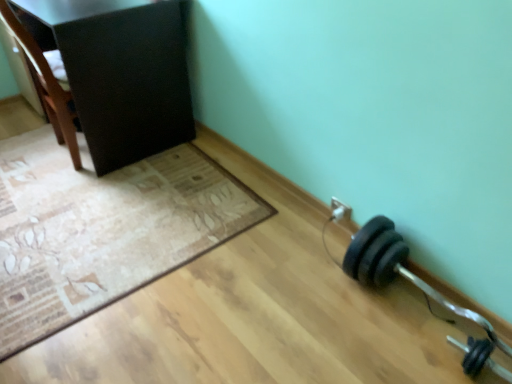
What do you see at coordinates (123, 74) in the screenshot? I see `matte black cabinet at upper left` at bounding box center [123, 74].

The height and width of the screenshot is (384, 512). What do you see at coordinates (408, 280) in the screenshot?
I see `black rubber dumbbell at lower right, which is the 1th dumbbell from top to bottom` at bounding box center [408, 280].

I want to click on black rubber dumbbell at lower right, placed as the 1th dumbbell when sorted from bottom to top, so click(x=499, y=370).

Where is `matte black cabinet at upper left`? This screenshot has height=384, width=512. matte black cabinet at upper left is located at coordinates (123, 74).

Find the location of a particular element. The width and height of the screenshot is (512, 384). dumbbell that is the 1st one below the brown wood chair at upper left (from a real-world perspective) is located at coordinates (408, 280).

Would you say brown wood chair at upper left is to the left or to the right of black rubber dumbbell at lower right, which is the 1th dumbbell from top to bottom, in the picture?

In the image, brown wood chair at upper left appears on the left side of black rubber dumbbell at lower right, which is the 1th dumbbell from top to bottom.

Considering the sizes of objects brown wood chair at upper left and black rubber dumbbell at lower right, the second dumbbell when ordered from bottom to top, in the image provided, who is smaller, brown wood chair at upper left or black rubber dumbbell at lower right, the second dumbbell when ordered from bottom to top,?

Smaller between the two is black rubber dumbbell at lower right, the second dumbbell when ordered from bottom to top.

Considering their positions, is brown wood chair at upper left located in front of or behind black rubber dumbbell at lower right, which is the 1th dumbbell from top to bottom?

Visually, brown wood chair at upper left is located behind black rubber dumbbell at lower right, which is the 1th dumbbell from top to bottom.

From a real-world perspective, is brown wood chair at upper left positioned under beige textured mat at lower left based on gravity?

No, from a real-world perspective, brown wood chair at upper left is not beneath beige textured mat at lower left.

Is brown wood chair at upper left closer to camera compared to beige textured mat at lower left?

No, brown wood chair at upper left is further to the viewer.

Is brown wood chair at upper left wider than beige textured mat at lower left?

Incorrect, the width of brown wood chair at upper left does not surpass that of beige textured mat at lower left.

Which is closer, (11,25) or (65,298)?

Point (11,25) appears to be farther away from the viewer than point (65,298).

Based on their sizes in the image, would you say beige textured mat at lower left is bigger or smaller than matte black cabinet at upper left?

Considering their sizes, beige textured mat at lower left takes up less space than matte black cabinet at upper left.

Which is more to the left, beige textured mat at lower left or matte black cabinet at upper left?

matte black cabinet at upper left.

From the image's perspective, relative to matte black cabinet at upper left, is beige textured mat at lower left above or below?

beige textured mat at lower left is situated lower than matte black cabinet at upper left in the image.

Considering the positions of point (221, 204) and point (163, 53), is point (221, 204) closer or farther from the camera than point (163, 53)?

Clearly, point (221, 204) is closer to the camera than point (163, 53).

Which is more to the right, black rubber dumbbell at lower right, the second dumbbell when ordered from bottom to top, or matte black cabinet at upper left?

From the viewer's perspective, black rubber dumbbell at lower right, the second dumbbell when ordered from bottom to top, appears more on the right side.

Is black rubber dumbbell at lower right, the second dumbbell when ordered from bottom to top, looking in the opposite direction of matte black cabinet at upper left?

No.

Would you consider black rubber dumbbell at lower right, which is the 1th dumbbell from top to bottom, to be distant from matte black cabinet at upper left?

That's right, there is a large distance between black rubber dumbbell at lower right, which is the 1th dumbbell from top to bottom, and matte black cabinet at upper left.

From a real-world perspective, is black rubber dumbbell at lower right, which is the 1th dumbbell from top to bottom, located higher than matte black cabinet at upper left?

Incorrect, from a real-world perspective, black rubber dumbbell at lower right, which is the 1th dumbbell from top to bottom, is lower than matte black cabinet at upper left.

Based on the photo, is beige textured mat at lower left looking in the opposite direction of brown wood chair at upper left?

No, brown wood chair at upper left is not at the back of beige textured mat at lower left.

Which of these two, beige textured mat at lower left or brown wood chair at upper left, stands shorter?

beige textured mat at lower left.

From the picture: Looking at the image, does matte black cabinet at upper left seem bigger or smaller compared to black rubber dumbbell at lower right, placed as the 1th dumbbell when sorted from bottom to top?

In the image, matte black cabinet at upper left appears to be larger than black rubber dumbbell at lower right, placed as the 1th dumbbell when sorted from bottom to top.

From the image's perspective, between matte black cabinet at upper left and black rubber dumbbell at lower right, the second dumbbell viewed from the top, which one is located above?

matte black cabinet at upper left.

The height and width of the screenshot is (384, 512). I want to click on the 2nd dumbbell to the right when counting from the matte black cabinet at upper left, so click(499, 370).

From a real-world perspective, between matte black cabinet at upper left and black rubber dumbbell at lower right, the second dumbbell viewed from the top, who is vertically higher?

matte black cabinet at upper left.

From a real-world perspective, is black rubber dumbbell at lower right, the second dumbbell when ordered from bottom to top, below beige textured mat at lower left?

No, from a real-world perspective, black rubber dumbbell at lower right, the second dumbbell when ordered from bottom to top, is not below beige textured mat at lower left.

In terms of height, does black rubber dumbbell at lower right, the second dumbbell when ordered from bottom to top, look taller or shorter compared to beige textured mat at lower left?

In the image, black rubber dumbbell at lower right, the second dumbbell when ordered from bottom to top, appears to be taller than beige textured mat at lower left.

Which is in front, black rubber dumbbell at lower right, the second dumbbell when ordered from bottom to top, or beige textured mat at lower left?

black rubber dumbbell at lower right, the second dumbbell when ordered from bottom to top, is in front.

Considering the sizes of objects black rubber dumbbell at lower right, the second dumbbell when ordered from bottom to top, and beige textured mat at lower left in the image provided, who is thinner, black rubber dumbbell at lower right, the second dumbbell when ordered from bottom to top, or beige textured mat at lower left?

black rubber dumbbell at lower right, the second dumbbell when ordered from bottom to top, is thinner.

From the brown wood chair at upper left, count 1st dumbbells forward and point to it. Please provide its 2D coordinates.

[(408, 280)]

What are the coordinates of `chair that is behind the beige textured mat at lower left` in the screenshot? It's located at (46, 84).

Estimate the real-world distances between objects in this image. Which object is further from black rubber dumbbell at lower right, the second dumbbell when ordered from bottom to top, matte black cabinet at upper left or brown wood chair at upper left?

Among the two, brown wood chair at upper left is located further to black rubber dumbbell at lower right, the second dumbbell when ordered from bottom to top.

Based on their spatial positions, is matte black cabinet at upper left or brown wood chair at upper left closer to black rubber dumbbell at lower right, the second dumbbell viewed from the top?

matte black cabinet at upper left is positioned closer to the anchor black rubber dumbbell at lower right, the second dumbbell viewed from the top.

When comparing their distances from matte black cabinet at upper left, does brown wood chair at upper left or black rubber dumbbell at lower right, placed as the 1th dumbbell when sorted from bottom to top, seem further?

black rubber dumbbell at lower right, placed as the 1th dumbbell when sorted from bottom to top.

Looking at the image, which one is located further to beige textured mat at lower left, matte black cabinet at upper left or brown wood chair at upper left?

brown wood chair at upper left is further to beige textured mat at lower left.

Considering their positions, is matte black cabinet at upper left positioned further to beige textured mat at lower left than black rubber dumbbell at lower right, the second dumbbell when ordered from bottom to top?

The object further to beige textured mat at lower left is black rubber dumbbell at lower right, the second dumbbell when ordered from bottom to top.

Looking at the image, which one is located closer to black rubber dumbbell at lower right, the second dumbbell viewed from the top, beige textured mat at lower left or matte black cabinet at upper left?

Based on the image, beige textured mat at lower left appears to be nearer to black rubber dumbbell at lower right, the second dumbbell viewed from the top.

From the image, which object appears to be farther from black rubber dumbbell at lower right, which is the 1th dumbbell from top to bottom, beige textured mat at lower left or brown wood chair at upper left?

brown wood chair at upper left is positioned further to the anchor black rubber dumbbell at lower right, which is the 1th dumbbell from top to bottom.

Looking at the image, which one is located further to brown wood chair at upper left, matte black cabinet at upper left or black rubber dumbbell at lower right, placed as the 1th dumbbell when sorted from bottom to top?

black rubber dumbbell at lower right, placed as the 1th dumbbell when sorted from bottom to top, lies further to brown wood chair at upper left than the other object.

Where is `furniture between brown wood chair at upper left and black rubber dumbbell at lower right, the second dumbbell when ordered from bottom to top, from left to right`? furniture between brown wood chair at upper left and black rubber dumbbell at lower right, the second dumbbell when ordered from bottom to top, from left to right is located at coordinates (123, 74).

Where is `dumbbell between beige textured mat at lower left and black rubber dumbbell at lower right, placed as the 1th dumbbell when sorted from bottom to top, in the horizontal direction`? The height and width of the screenshot is (384, 512). dumbbell between beige textured mat at lower left and black rubber dumbbell at lower right, placed as the 1th dumbbell when sorted from bottom to top, in the horizontal direction is located at coordinates (408, 280).

Locate an element on the screen. This screenshot has width=512, height=384. dumbbell between brown wood chair at upper left and black rubber dumbbell at lower right, the second dumbbell viewed from the top is located at coordinates (408, 280).

At what (x,y) coordinates should I click in order to perform the action: click on mat between brown wood chair at upper left and black rubber dumbbell at lower right, placed as the 1th dumbbell when sorted from bottom to top, in the horizontal direction. Please return your answer as a coordinate pair (x, y). The height and width of the screenshot is (384, 512). Looking at the image, I should click on point(102,229).